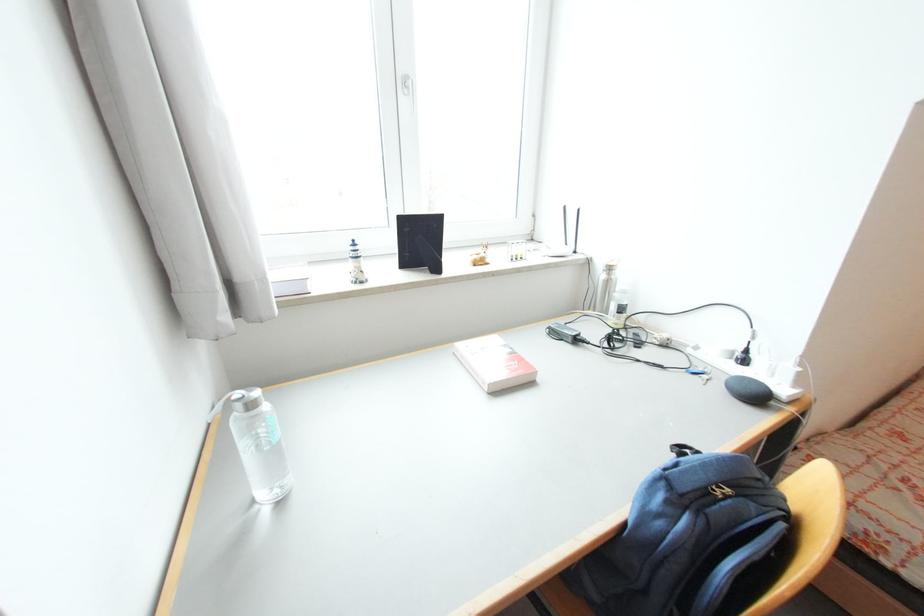
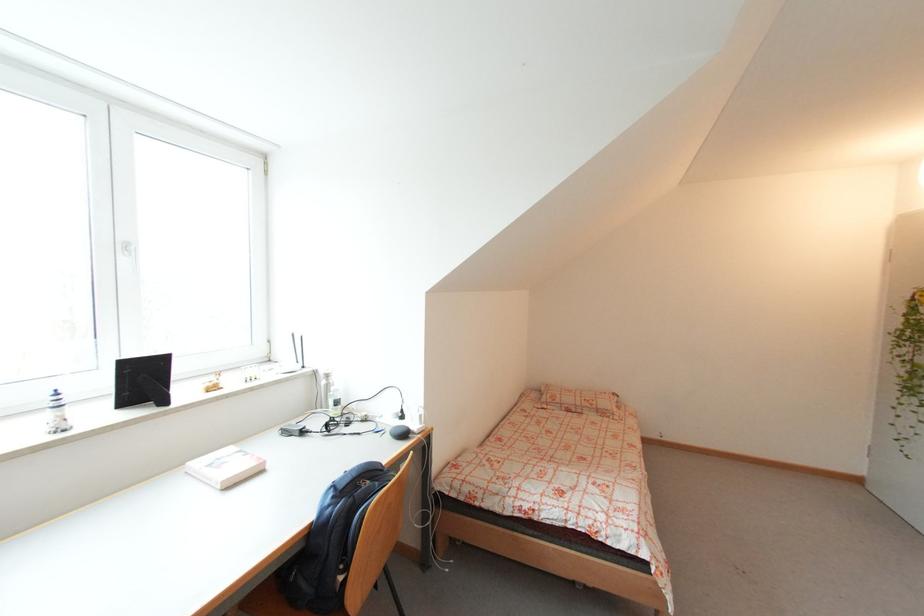
Where in the second image is the point corresponding to [357,243] from the first image?

(58, 392)